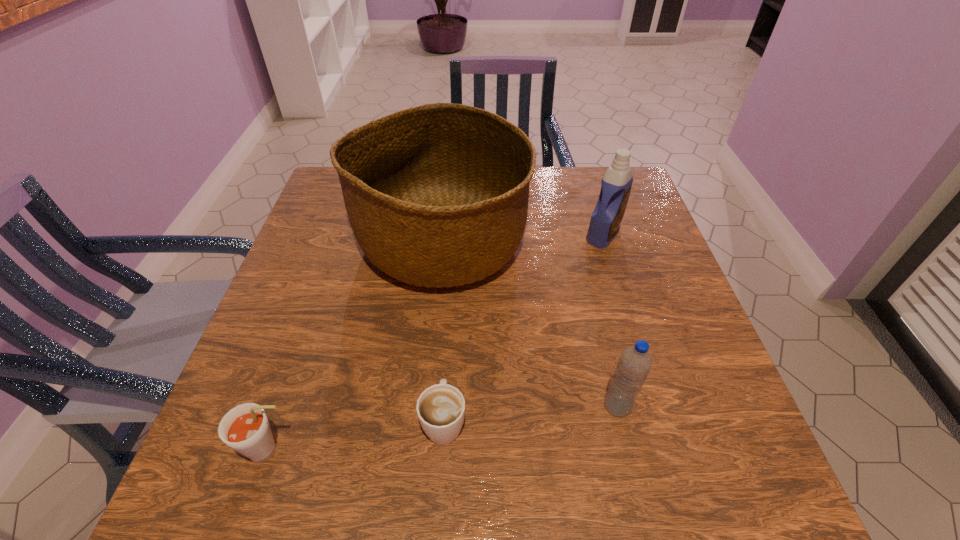
Select which object appears as the closest to the water bottle. Please provide its 2D coordinates. Your answer should be formatted as a tuple, i.e. [(x, y)], where the tuple contains the x and y coordinates of a point satisfying the conditions above.

[(437, 195)]

Identify which object is the fourth closest to the detergent. Please provide its 2D coordinates. Your answer should be formatted as a tuple, i.e. [(x, y)], where the tuple contains the x and y coordinates of a point satisfying the conditions above.

[(245, 428)]

You are a GUI agent. You are given a task and a screenshot of the screen. Output one action in this format:
    pyautogui.click(x=<x>, y=<y>)
    Task: Click on the vacant region that satisfies the following two spatial constraints: 1. on the front side of the third tallest object; 2. on the drink side of the fourth tallest object
    
    Given the screenshot: What is the action you would take?
    pyautogui.click(x=628, y=450)

Identify the location of free spot that satisfies the following two spatial constraints: 1. with the handle on the side of the third shortest object; 2. on the left side of the cappuccino. (444, 406).